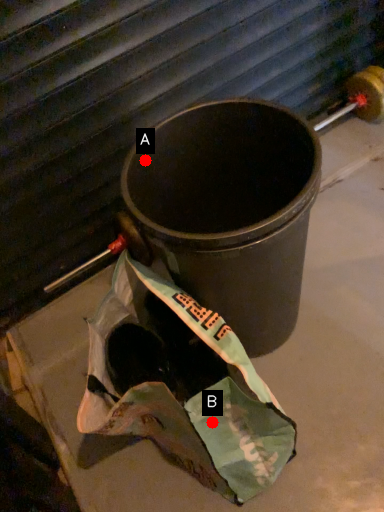
Question: Two points are circled on the image, labeled by A and B beside each circle. Among these points, which one is farthest from the camera?

Choices:
 (A) A is further
 (B) B is further

Answer: (A)